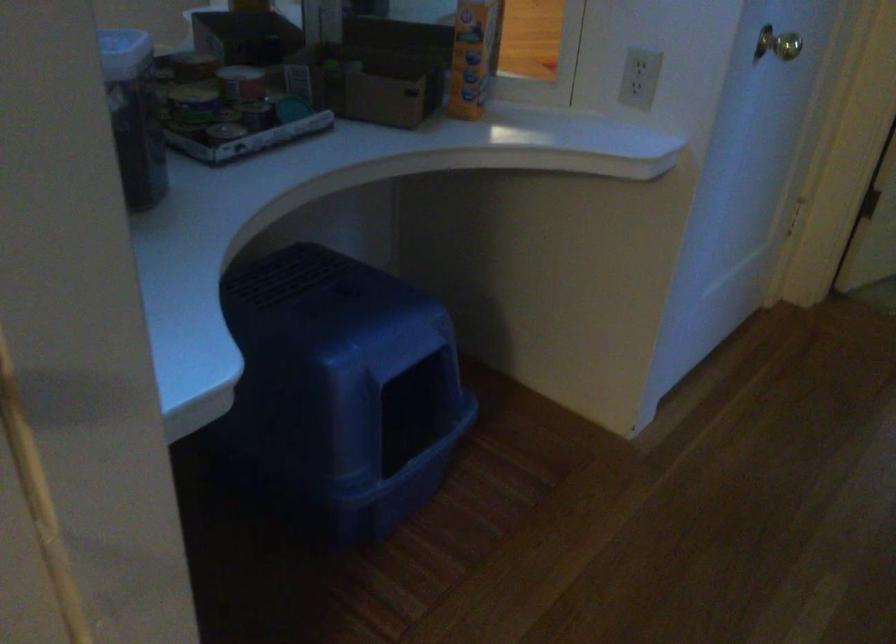
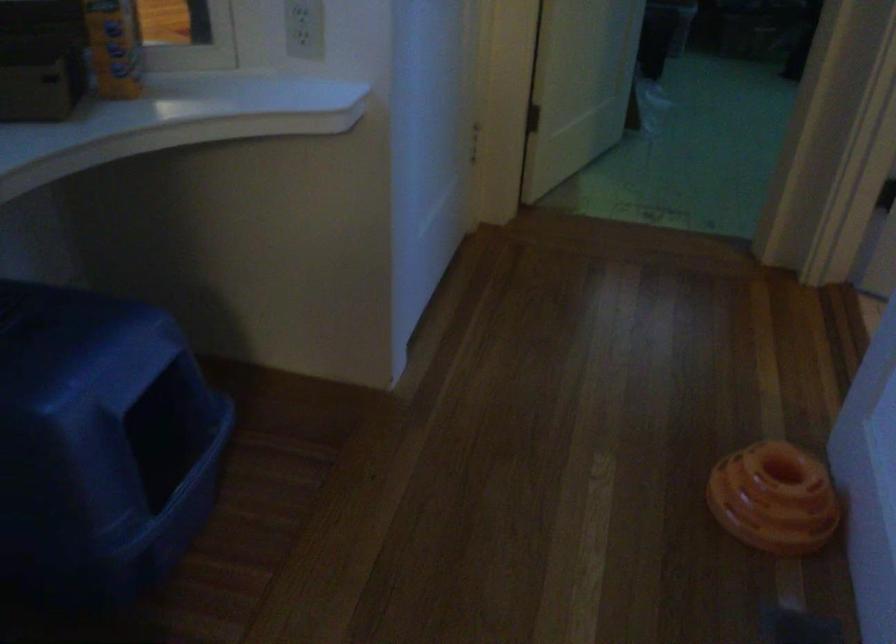
The images are taken continuously from a first-person perspective. In which direction are you moving?

The cameraman moved toward left, forward.